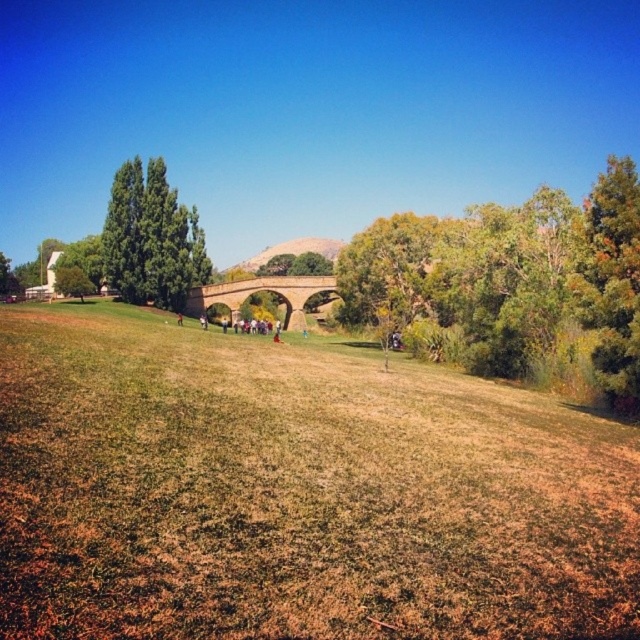
Question: Based on their relative distances, which object is nearer to the green leafy tree at center?

Choices:
 (A) green leafy tree at left
 (B) brown dry grass at center
 (C) brown stone bridge at center
 (D) green grassy hillside at center

Answer: (B)

Question: Can you confirm if green leafy tree at center is positioned to the left of green grassy hillside at center?

Choices:
 (A) yes
 (B) no

Answer: (B)

Question: Which point is farther to the camera?

Choices:
 (A) (150, 285)
 (B) (401, 228)
 (C) (294, 288)
 (D) (104, 579)

Answer: (C)

Question: Which point is farther from the camera taking this photo?

Choices:
 (A) (628, 296)
 (B) (198, 289)

Answer: (B)

Question: Observing the image, what is the correct spatial positioning of brown dry grass at center in reference to green grassy hillside at center?

Choices:
 (A) left
 (B) right

Answer: (B)

Question: Can you confirm if brown stone bridge at center is bigger than green grassy hillside at center?

Choices:
 (A) yes
 (B) no

Answer: (A)